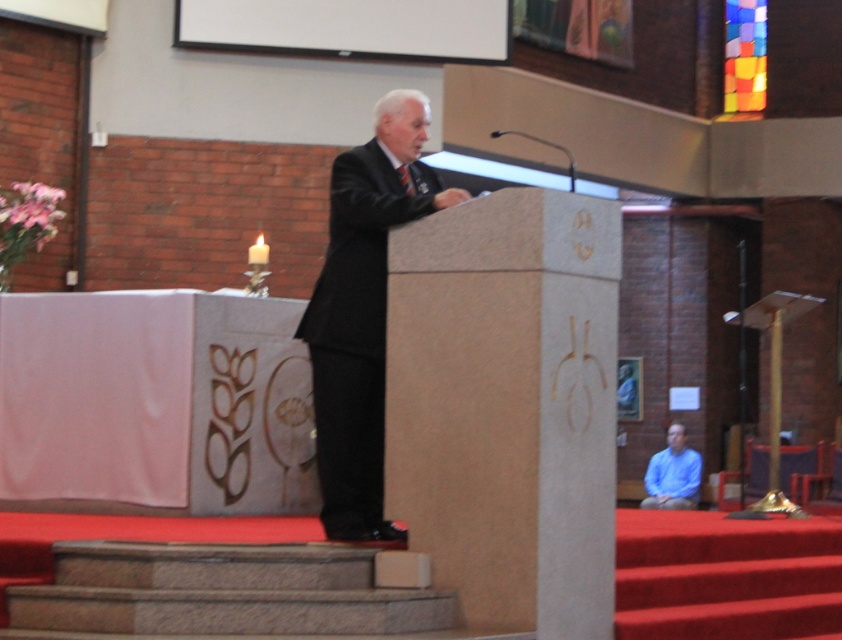
Is dark suit at center smaller than blue matte shirt at lower right?

No, dark suit at center is not smaller than blue matte shirt at lower right.

Does dark suit at center appear over blue matte shirt at lower right?

Indeed, dark suit at center is positioned over blue matte shirt at lower right.

Between point (334, 440) and point (694, 492), which one is positioned behind?

The point (694, 492) is behind.

The height and width of the screenshot is (640, 842). What are the coordinates of `dark suit at center` in the screenshot? It's located at (363, 310).